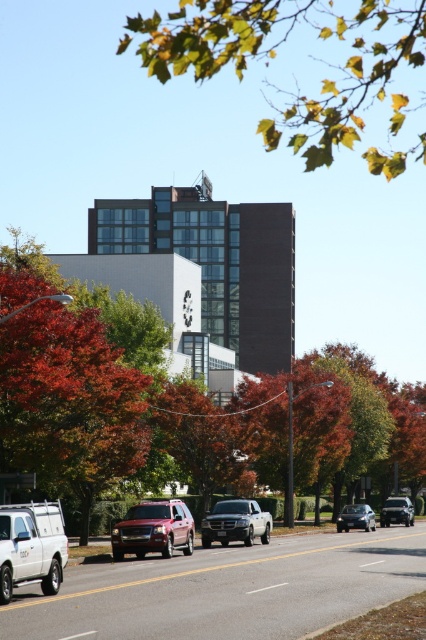
Question: Which is nearer to the metallic maroon suv at center?

Choices:
 (A) silver metallic truck at center
 (B) white matte truck at lower left

Answer: (A)

Question: Can you confirm if orange leafy tree at center is positioned below satin black sedan at lower right?

Choices:
 (A) no
 (B) yes

Answer: (A)

Question: Can you confirm if green leafy tree at center is wider than metallic maroon suv at center?

Choices:
 (A) yes
 (B) no

Answer: (A)

Question: Which object is farther from the camera taking this photo?

Choices:
 (A) satin black sedan at center
 (B) green leafy tree at center
 (C) orange leafy tree at center

Answer: (A)

Question: Does green leafy branch at upper center appear on the left side of white matte truck at lower left?

Choices:
 (A) yes
 (B) no

Answer: (B)

Question: Which point is farther from the camera taking this photo?

Choices:
 (A) (308, 400)
 (B) (370, 525)

Answer: (A)